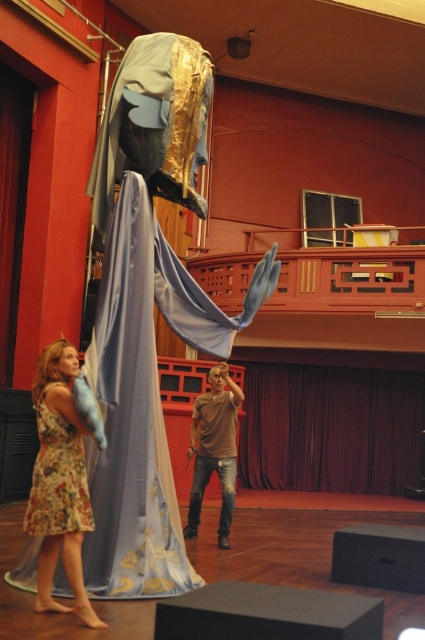
You are an actor backstage preparing for your entrance. You see the velvet dark red curtain at center. Where is the curtain positioned relative to the stage?

The velvet dark red curtain at center is positioned at point 0.670 on the x axis and 0.779 on the y axis, meaning it is located towards the right and lower middle area of the stage.

You are a stagehand preparing for a play. You need to move a 20 feet long ladder from the floral dress at lower left to the velvet dark red curtain at center. Is the space between them sufficient for the ladder to be moved without bending it?

The distance between the velvet dark red curtain at center and the floral dress at lower left is 30.40 feet, which is greater than the ladder length of 20 feet. Therefore, the ladder can be moved straight without bending.

You are an actor preparing for a play and see the floral dress at lower left and the brown cotton shirt at center in the scene. Which clothing item is positioned higher in the image?

The floral dress at lower left is located above the brown cotton shirt at center, so it is positioned higher in the image.